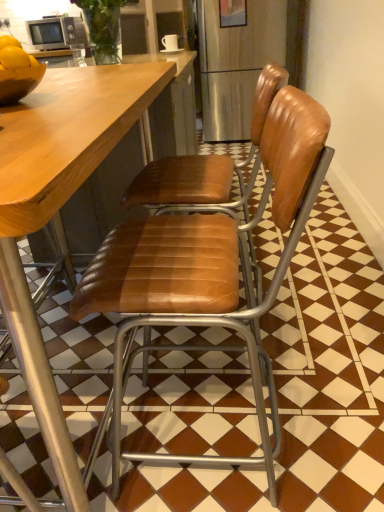
Question: Is brown leather chair at center, which appears as the second chair when viewed from the back, inside or outside of brown leather chair at center, the 1th chair from the back?

Choices:
 (A) inside
 (B) outside

Answer: (B)

Question: From the image's perspective, is brown leather chair at center, which appears as the second chair when viewed from the back, positioned above or below brown leather chair at center, the 1th chair from the back?

Choices:
 (A) above
 (B) below

Answer: (B)

Question: Based on their relative distances, which object is nearer to the brown leather chair at center, the 1th chair from the back?

Choices:
 (A) shiny brown bowl at left
 (B) brown leather chair at center, which appears as the second chair when viewed from the back
 (C) matte silver microwave at upper left
 (D) white glossy mug at upper center

Answer: (B)

Question: Estimate the real-world distances between objects in this image. Which object is closer to the shiny brown bowl at left?

Choices:
 (A) brown leather chair at center, which ranks as the 1th chair in front-to-back order
 (B) brown leather chair at center, the 1th chair from the back
 (C) white glossy mug at upper center
 (D) matte silver microwave at upper left

Answer: (B)